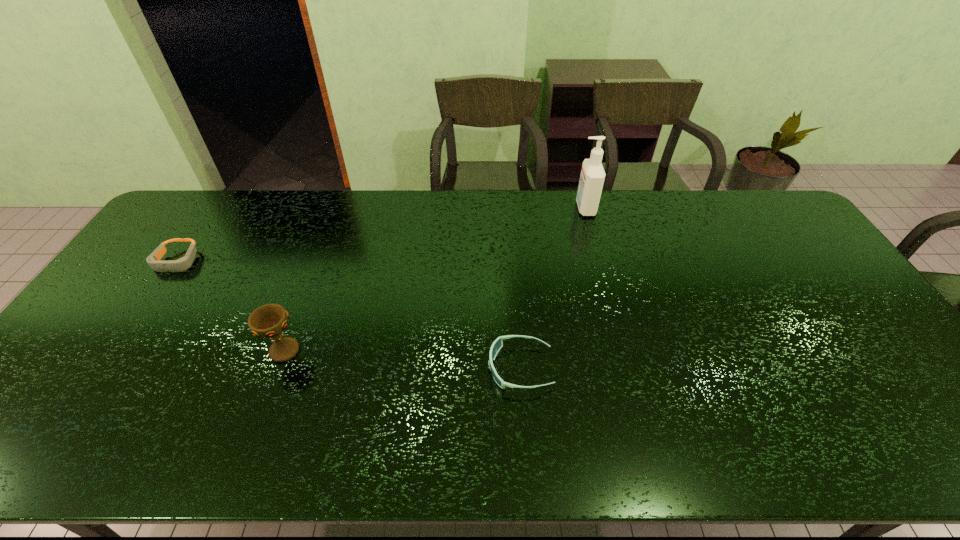
You are a GUI agent. You are given a task and a screenshot of the screen. Output one action in this format:
    pyautogui.click(x=<x>, y=<y>)
    Task: Click on the object that stands as the third closest to the shorter goggles
    The width and height of the screenshot is (960, 540).
    Given the screenshot: What is the action you would take?
    pyautogui.click(x=592, y=177)

Identify the location of the second closest object relative to the tallest object. (268, 321).

Where is `blank space that satisfies the following two spatial constraints: 1. on the front label of the farthest object; 2. on the front side of the third shortest object`? The width and height of the screenshot is (960, 540). blank space that satisfies the following two spatial constraints: 1. on the front label of the farthest object; 2. on the front side of the third shortest object is located at coordinates (623, 350).